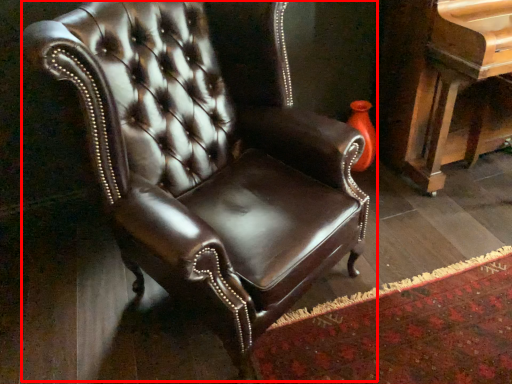
Question: From the image's perspective, where is chair (annotated by the red box) located in relation to piano in the image?

Choices:
 (A) above
 (B) below

Answer: (B)